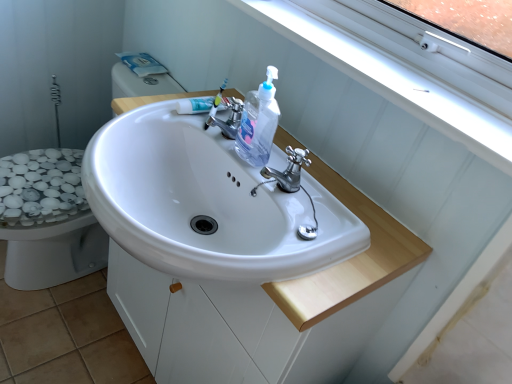
The height and width of the screenshot is (384, 512). What are the coordinates of `free spot to the right of polished chrome faucet at center, positioned as the 1th tap in bottom-to-top order` in the screenshot? It's located at (361, 220).